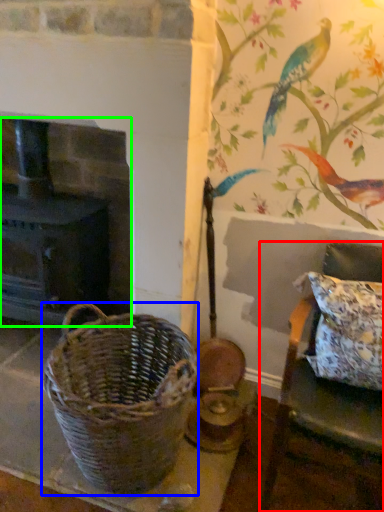
Question: Which object is the closest to the furniture (highlighted by a red box)? Choose among these: picnic basket (highlighted by a blue box) or fireplace (highlighted by a green box).

Choices:
 (A) picnic basket
 (B) fireplace

Answer: (A)